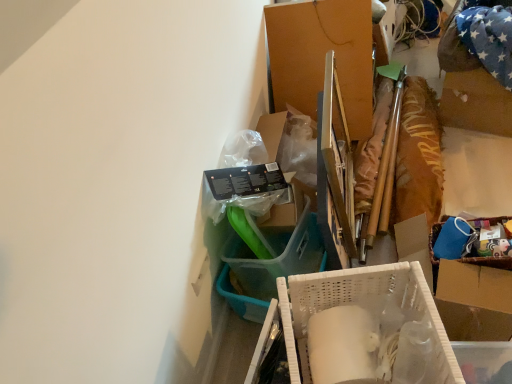
Question: From a real-world perspective, is cardboard box at center, acting as the 1th box starting from the back, above or below white plastic basket at center, which appears as the 1th box when ordered from the bottom?

Choices:
 (A) above
 (B) below

Answer: (B)

Question: Is cardboard box at center, acting as the second box starting from the bottom, wider or thinner than white plastic basket at center, placed as the 2th box when sorted from top to bottom?

Choices:
 (A) wide
 (B) thin

Answer: (A)

Question: Which object is the farthest from the cardboard box at center, acting as the second box starting from the bottom?

Choices:
 (A) white plastic basket at center, placed as the 2th box when sorted from top to bottom
 (B) white plastic basket at center

Answer: (A)

Question: Considering the real-world distances, which object is farthest from the white plastic basket at center?

Choices:
 (A) cardboard box at center, positioned as the 1th box in top-to-bottom order
 (B) white plastic basket at center, which appears as the 1th box when ordered from the bottom

Answer: (B)